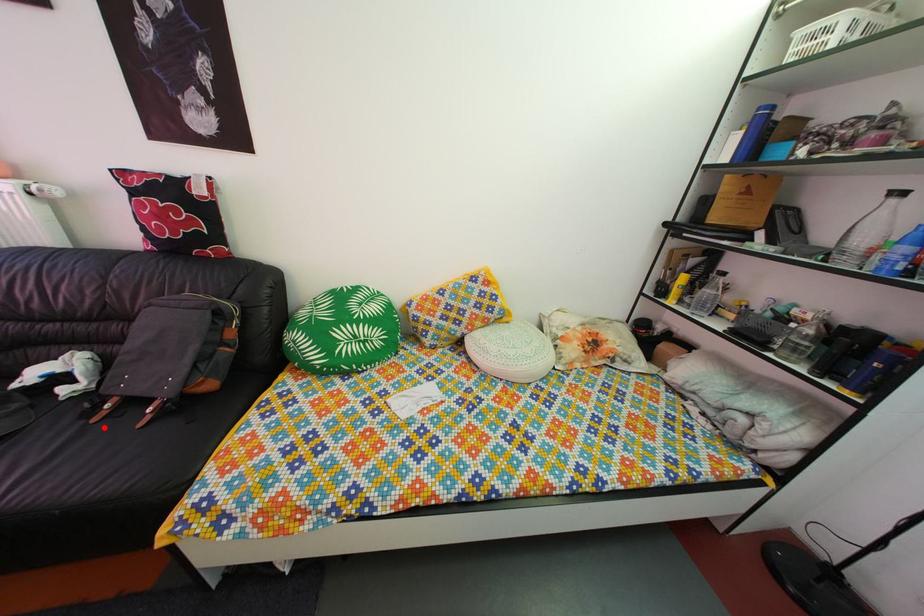
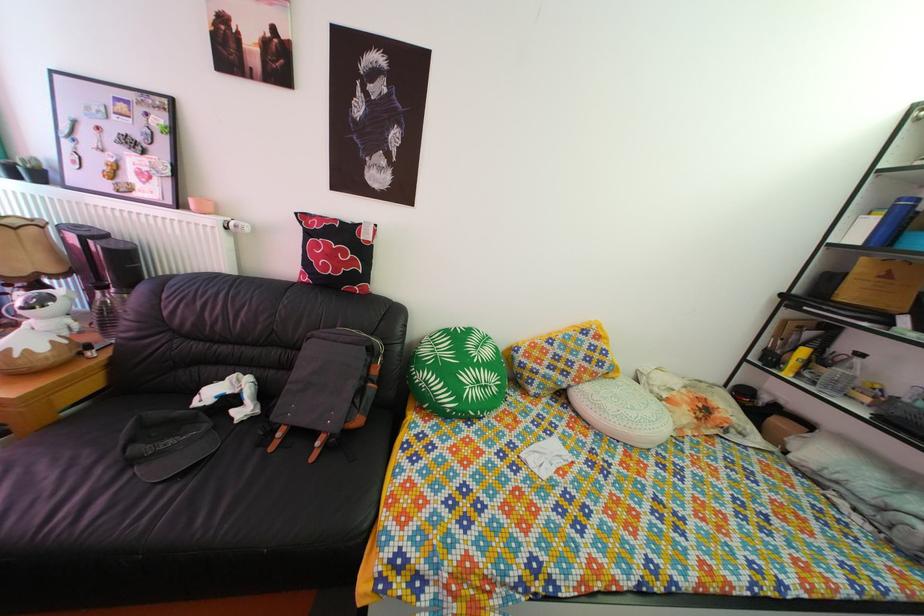
The point at the highlighted location is marked in the first image. Where is the corresponding point in the second image?

(281, 456)